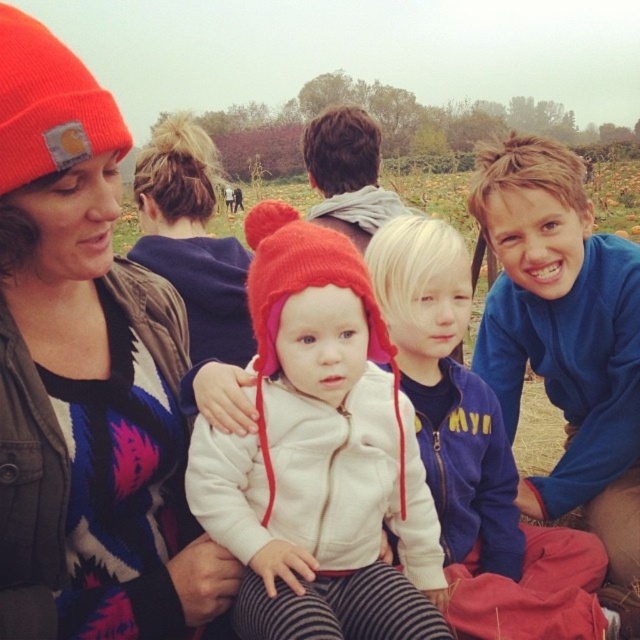
Question: Is matte orange beanie at upper left positioned before matte purple sweater at upper center?

Choices:
 (A) no
 (B) yes

Answer: (B)

Question: Is matte orange beanie at upper left wider than matte purple sweater at upper center?

Choices:
 (A) no
 (B) yes

Answer: (A)

Question: Which object appears farthest from the camera in this image?

Choices:
 (A) white fleece jacket at center
 (B) blue fleece jacket at lower right
 (C) orange knit beanie at upper left
 (D) red knitted hat at center

Answer: (B)

Question: Which point appears farthest from the camera in this image?

Choices:
 (A) (170, 148)
 (B) (12, 77)
 (C) (541, 172)
 (D) (387, 342)

Answer: (A)

Question: Which point is farther from the camera taking this photo?

Choices:
 (A) (246, 230)
 (B) (490, 513)
 (C) (355, 579)
 (D) (29, 19)

Answer: (B)

Question: Does matte red knit hat at center appear on the right side of matte purple sweater at upper center?

Choices:
 (A) yes
 (B) no

Answer: (A)